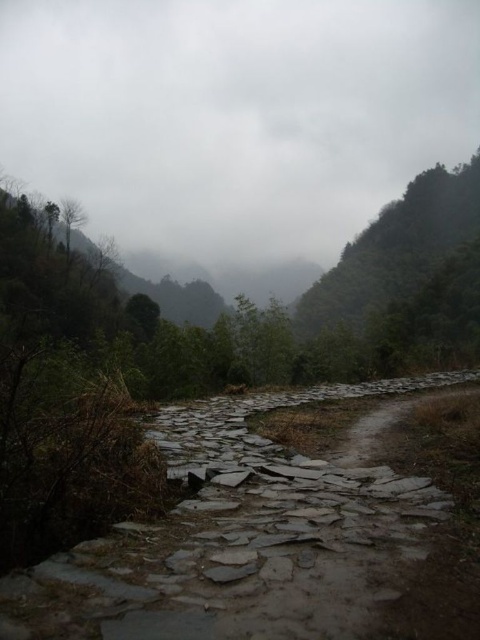
Is point (342, 10) in front of point (379, 465)?

No, it is behind (379, 465).

Who is more distant from viewer, (372, 163) or (303, 474)?

The point (372, 163) is behind.

Locate an element on the screen. The height and width of the screenshot is (640, 480). gray cloudy sky at upper center is located at coordinates (235, 116).